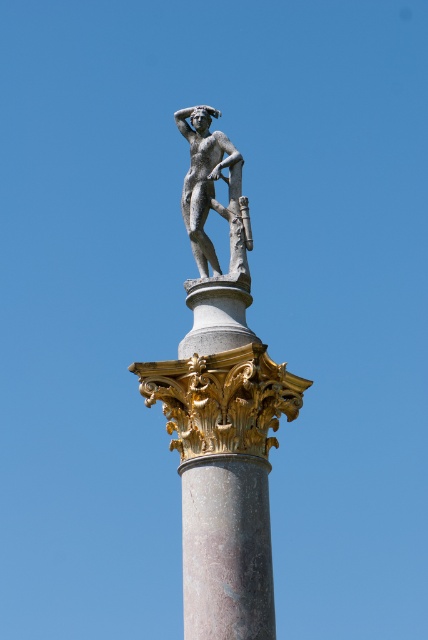
Between bronze statue at center and polished bronze statue at top, which one is positioned lower?

bronze statue at center

In the scene shown: Does bronze statue at center have a lesser width compared to polished bronze statue at top?

Incorrect, bronze statue at center's width is not less than polished bronze statue at top's.

Is point (205, 189) positioned behind point (214, 147)?

No, it is in front of (214, 147).

Identify the location of bronze statue at center. This screenshot has width=428, height=640. (222, 410).

From the picture: Is bronze statue at center positioned before marble column at center?

Yes, bronze statue at center is in front of marble column at center.

Can you confirm if bronze statue at center is thinner than marble column at center?

No.

Who is more forward, (247, 429) or (187, 481)?

Point (247, 429) is in front.

You are a GUI agent. You are given a task and a screenshot of the screen. Output one action in this format:
    pyautogui.click(x=<x>, y=<y>)
    Task: Click on the bronze statue at center
    The image size is (428, 640).
    Given the screenshot: What is the action you would take?
    pyautogui.click(x=222, y=410)

Which is more to the right, marble column at center or polished bronze statue at top?

polished bronze statue at top

Is marble column at center above polished bronze statue at top?

No.

Who is more distant from viewer, (214, 541) or (193, 204)?

The point (193, 204) is more distant.

At what (x,y) coordinates should I click in order to perform the action: click on marble column at center. Please return your answer as a coordinate pair (x, y). The image size is (428, 640). Looking at the image, I should click on (226, 547).